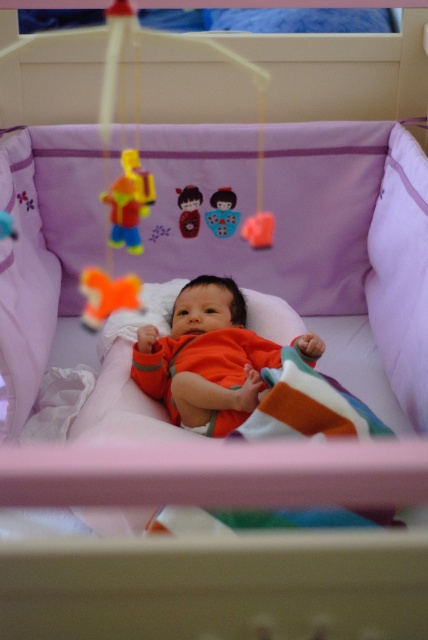
You are a caregiver checking the safety of the crib. The orange soft fabric baby at center is sleeping, and there is a yellow plastic toy at upper center. Based on their sizes, could the baby potentially reach and grab the toy if it moves its arms?

The orange soft fabric baby at center is taller than the yellow plastic toy at upper center. Since the baby is taller, it is likely within reach, so yes, the baby could potentially reach and grab the toy if it moves its arms.

What are the exact coordinates of the orange soft fabric baby at center in the image?

The orange soft fabric baby at center is located at point (x=205, y=358).

You are a parent checking the safety of the baby crib. The orange soft fabric baby at center is currently lying on their back. You notice the yellow plastic toy at upper center hanging above them. Based on their sizes, do you think the baby can easily reach the toy?

The orange soft fabric baby at center is larger in size than the yellow plastic toy at upper center. Since the baby is bigger, they might have an easier time reaching the toy if they stretch their arms, but the toy is still small compared to the baby.